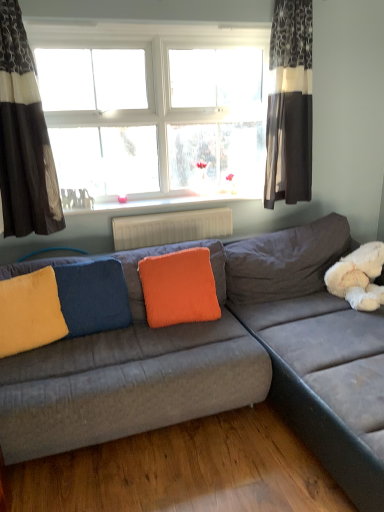
Question: From their relative heights in the image, would you say velvet gray couch at center is taller or shorter than white glass window at upper center?

Choices:
 (A) short
 (B) tall

Answer: (A)

Question: Does point (307, 367) appear closer or farther from the camera than point (109, 187)?

Choices:
 (A) closer
 (B) farther

Answer: (A)

Question: Which object is the farthest from the yellow fuzzy pillow at left, acting as the 1th pillow starting from the left?

Choices:
 (A) white glass window at upper center
 (B) white glossy radiator at upper center
 (C) textured gray curtain at upper right, which is the second curtain in left-to-right order
 (D) orange fuzzy pillow at center, positioned as the 1th pillow in right-to-left order
 (E) white plastic radiator at center

Answer: (C)

Question: Based on their relative distances, which object is nearer to the white glass window at upper center?

Choices:
 (A) orange fuzzy pillow at center, positioned as the 1th pillow in right-to-left order
 (B) textured gray curtain at upper right, arranged as the 1th curtain when viewed from the right
 (C) yellow fuzzy pillow at left, acting as the 1th pillow starting from the left
 (D) blue velvet pillow at center, marked as the second pillow in a left-to-right arrangement
 (E) white plastic radiator at center

Answer: (B)